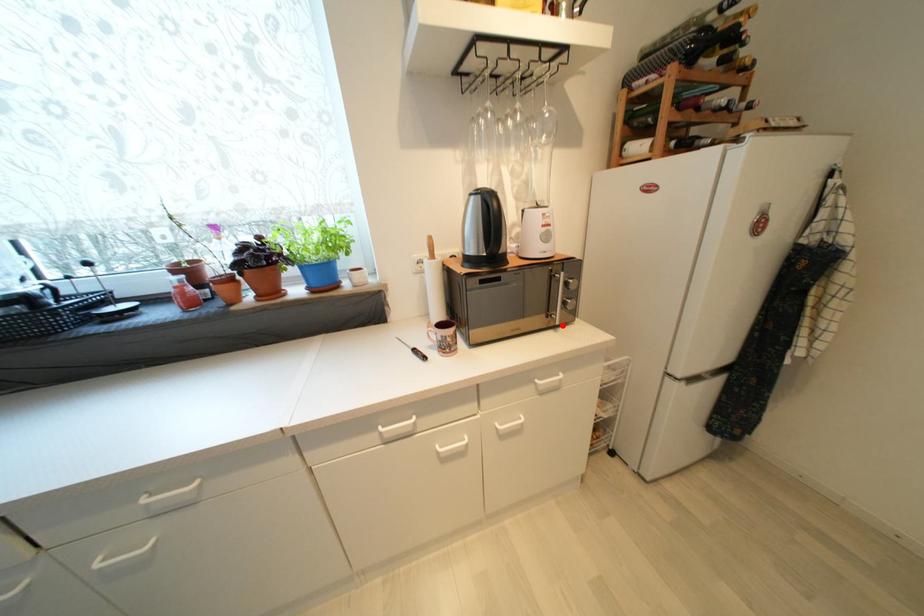
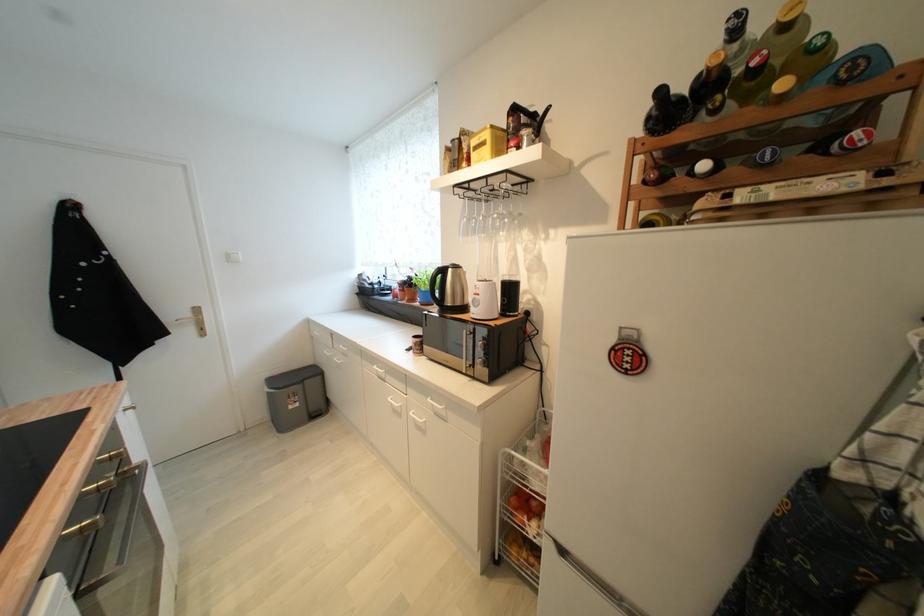
Locate, in the second image, the point that corresponds to the highlighted location in the first image.

(469, 374)